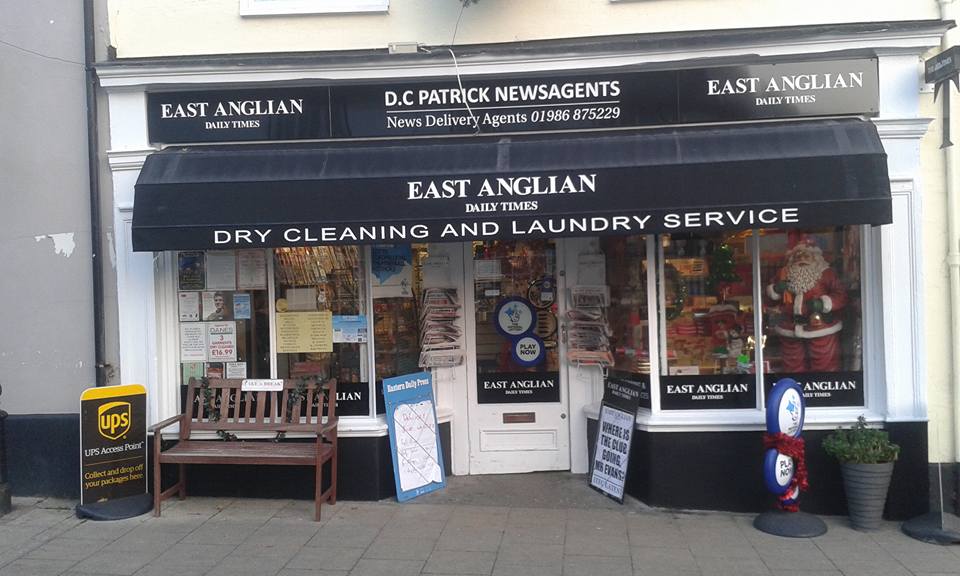
This screenshot has height=576, width=960. In order to click on mail slot on door in this screenshot , I will do `click(520, 416)`.